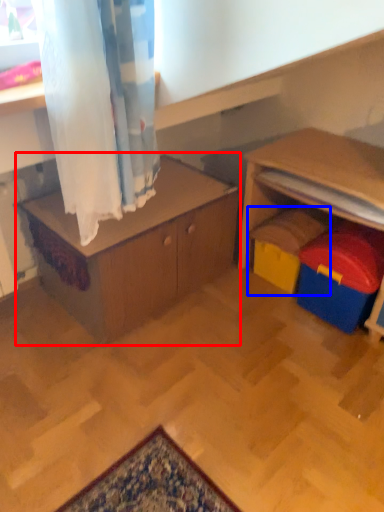
Question: Among these objects, which one is farthest to the camera, table (highlighted by a red box) or toy (highlighted by a blue box)?

Choices:
 (A) table
 (B) toy

Answer: (B)